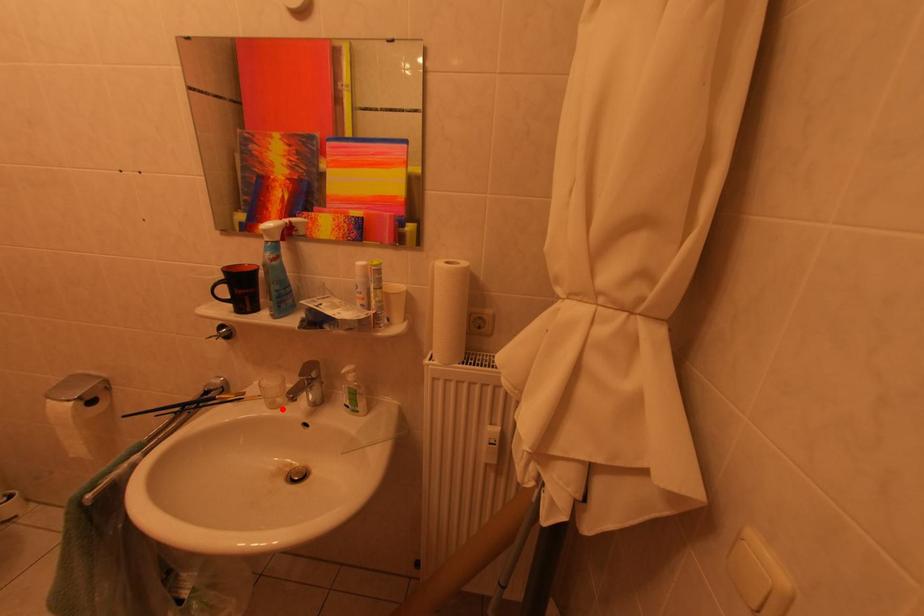
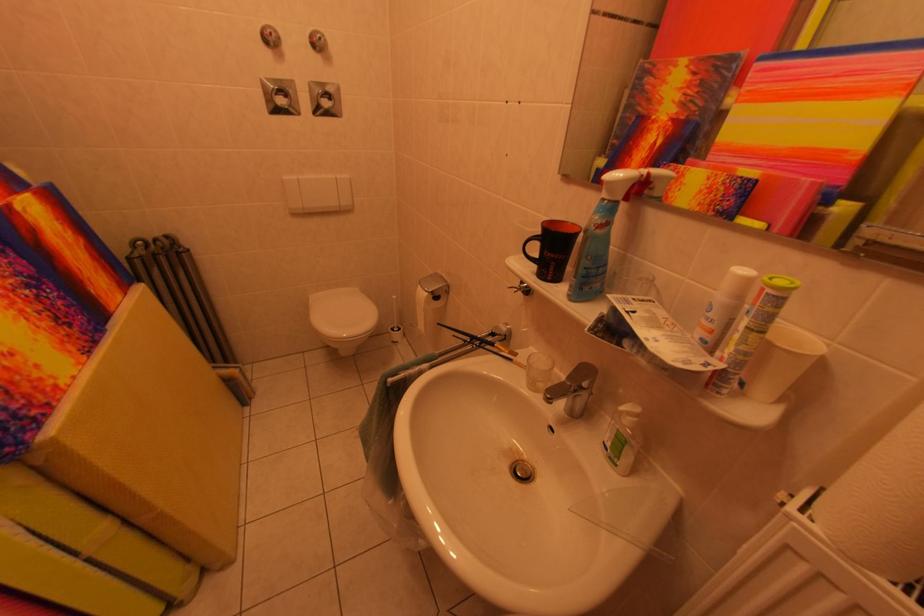
Question: I am providing you with two images of the same scene from different viewpoints. A red point is marked on the first image. Is the red point's position out of view in image 2?

Choices:
 (A) Yes
 (B) No

Answer: (B)